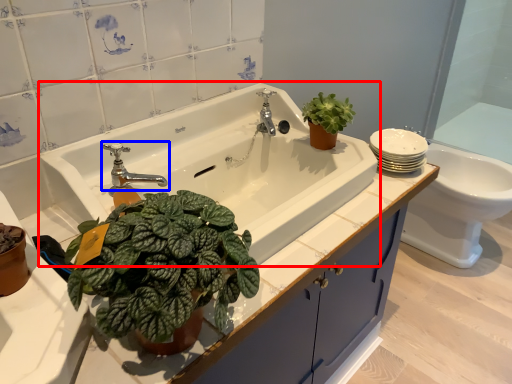
Question: Which point is further to the camera, sink (highlighted by a red box) or tap (highlighted by a blue box)?

Choices:
 (A) sink
 (B) tap

Answer: (B)